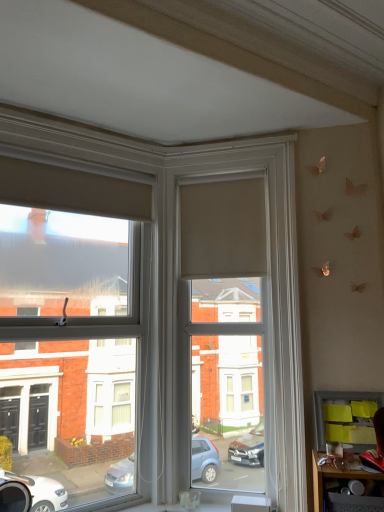
Question: In terms of size, does matte beige roller blind at center appear bigger or smaller than matte beige roller blind at center?

Choices:
 (A) small
 (B) big

Answer: (B)

Question: Is matte beige roller blind at center inside the boundaries of matte beige roller blind at center, or outside?

Choices:
 (A) inside
 (B) outside

Answer: (B)

Question: Which is farther from the matte beige roller blind at center?

Choices:
 (A) yellow sticky notes at lower right
 (B) matte black table at lower right
 (C) matte beige roller blind at center

Answer: (B)

Question: Which is nearer to the matte beige roller blind at center?

Choices:
 (A) matte black table at lower right
 (B) yellow sticky notes at lower right
 (C) matte beige roller blind at center

Answer: (C)